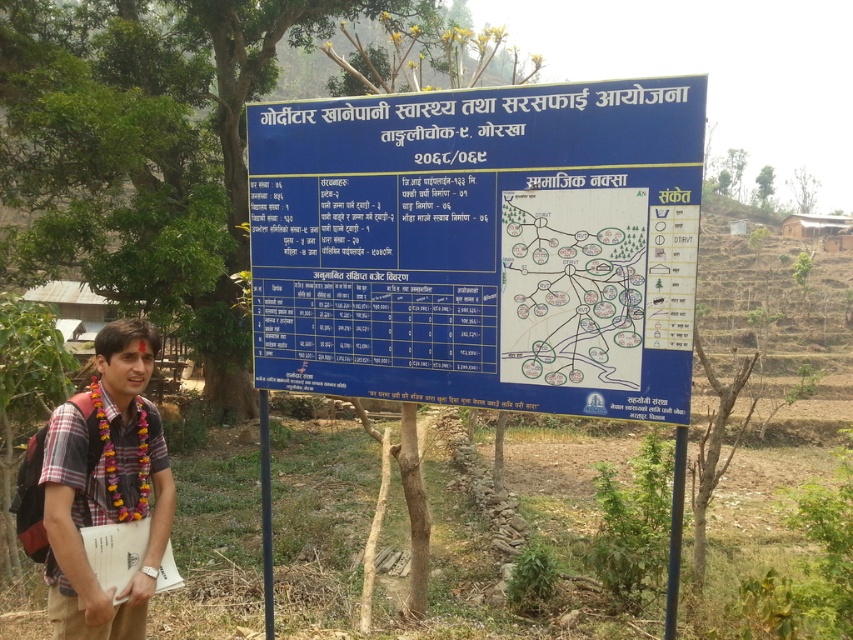
Question: Which of the following is the farthest from the observer?

Choices:
 (A) (138, 497)
 (B) (598, 268)

Answer: (B)

Question: In this image, where is blue plastic signboard at center located relative to white paper map at center?

Choices:
 (A) right
 (B) left

Answer: (B)

Question: Which point is closer to the camera?

Choices:
 (A) plaid shirt at center
 (B) white paper map at center

Answer: (A)

Question: Can you confirm if blue plastic signboard at center is positioned to the right of plaid shirt at center?

Choices:
 (A) yes
 (B) no

Answer: (A)

Question: Which of the following is the closest to the observer?

Choices:
 (A) blue plastic signboard at center
 (B) white paper map at center

Answer: (A)

Question: Observing the image, what is the correct spatial positioning of blue plastic signboard at center in reference to plaid shirt at center?

Choices:
 (A) right
 (B) left

Answer: (A)